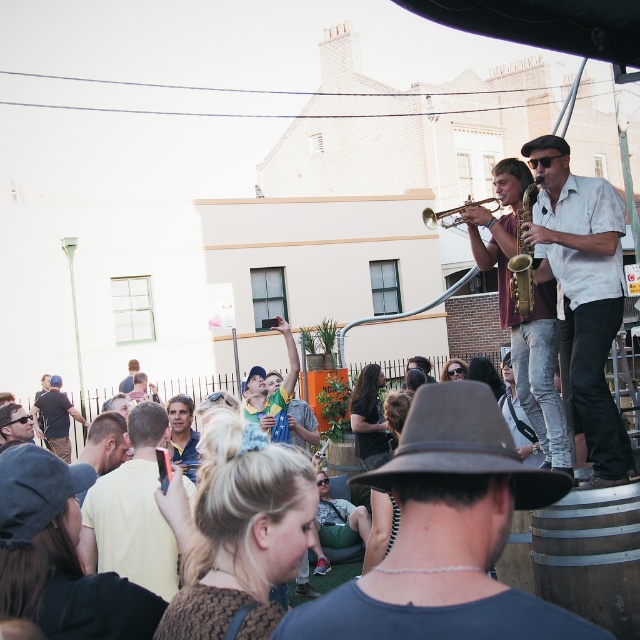
You are a photographer positioned at the back of the crowd. You want to take a photo of the gold metallic trumpet at upper center but need to ensure the white shirt at upper right won

The white shirt at upper right is closer to the viewer than the gold metallic trumpet at upper center, so it may block the view of the trumpet in your photo.

You are a photographer positioned at the origin point of the image coordinate system. You want to capture a photo of the brown felt fedora at center. What are the coordinates where you should aim your camera?

The brown felt fedora at center is located at point coordinates of [464,444]. So you should aim your camera at those coordinates to capture the brown felt fedora at center.